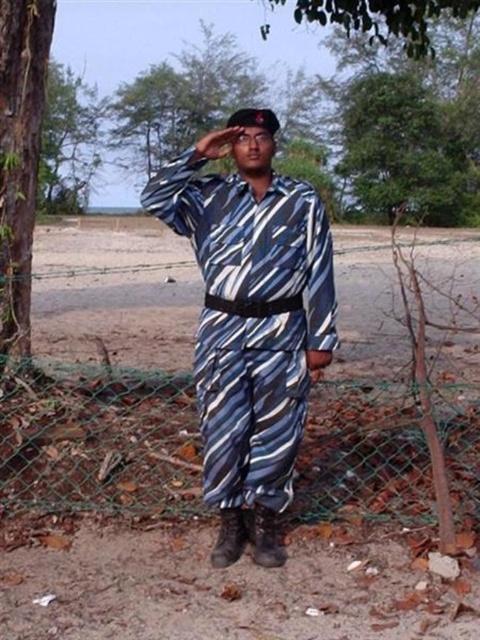
Question: Which point is farther to the camera?

Choices:
 (A) (313, 420)
 (B) (8, 209)
 (C) (62, 68)
 (D) (276, 518)

Answer: (C)

Question: Among these objects, which one is farthest from the camera?

Choices:
 (A) green vine-covered tree at left
 (B) green leafy tree at upper left
 (C) blue striped uniform at center

Answer: (B)

Question: Which is nearer to the green leafy tree at upper left?

Choices:
 (A) green vine-covered tree at left
 (B) green wire mesh fence at lower right

Answer: (A)

Question: Does green wire mesh fence at lower right appear on the left side of blue striped uniform at center?

Choices:
 (A) yes
 (B) no

Answer: (B)

Question: Considering the relative positions of green vine-covered tree at left and green leafy tree at upper left in the image provided, where is green vine-covered tree at left located with respect to green leafy tree at upper left?

Choices:
 (A) right
 (B) left

Answer: (A)

Question: Considering the relative positions of green wire mesh fence at lower right and green leafy tree at upper left in the image provided, where is green wire mesh fence at lower right located with respect to green leafy tree at upper left?

Choices:
 (A) below
 (B) above

Answer: (A)